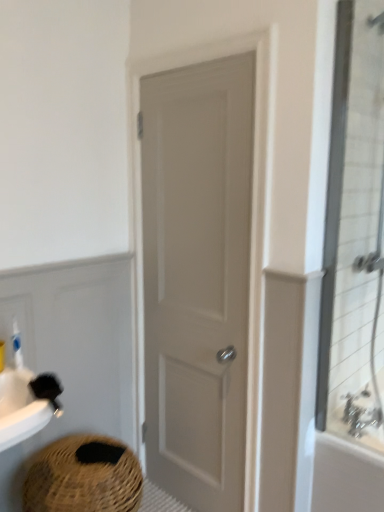
Question: Considering the positions of silver metallic faucet at upper right and clear glass shower door at right in the image, is silver metallic faucet at upper right bigger or smaller than clear glass shower door at right?

Choices:
 (A) big
 (B) small

Answer: (B)

Question: Does point (345, 404) appear closer or farther from the camera than point (357, 151)?

Choices:
 (A) closer
 (B) farther

Answer: (B)

Question: Which object is positioned closest to the white matte door at center?

Choices:
 (A) silver metallic faucet at upper right
 (B) clear glass shower door at right
 (C) white plastic bottle at left
 (D) braided straw basket at lower left
 (E) silver metallic faucet at upper right

Answer: (B)

Question: Estimate the real-world distances between objects in this image. Which object is farther from the braided straw basket at lower left?

Choices:
 (A) white matte door at center
 (B) white plastic bottle at left
 (C) silver metallic faucet at upper right
 (D) silver metallic faucet at upper right
 (E) clear glass shower door at right

Answer: (E)